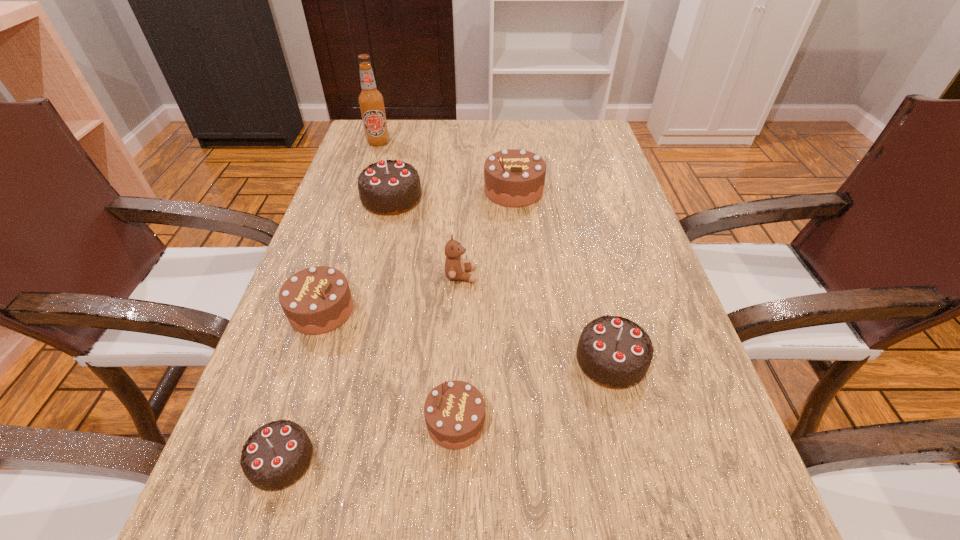
Locate an element on the screen. Image resolution: width=960 pixels, height=540 pixels. free location located 0.130m on the back of the nearest chocolate chocolate cake is located at coordinates (314, 358).

The width and height of the screenshot is (960, 540). I want to click on object that is positioned at the far edge, so click(x=371, y=101).

Locate an element on the screen. The image size is (960, 540). beer bottle located at the left edge is located at coordinates (371, 101).

In order to click on object located in the right edge section of the desktop in this screenshot , I will do `click(614, 352)`.

Identify the location of object that is positioned at the far left corner. (371, 101).

Identify the location of vacant space at the far edge of the desktop. (470, 133).

At what (x,y) coordinates should I click in order to perform the action: click on vacant space at the left edge of the desktop. Please return your answer as a coordinate pair (x, y). Looking at the image, I should click on (369, 288).

In order to click on free spot at the right edge of the desktop in this screenshot , I will do `click(703, 398)`.

The width and height of the screenshot is (960, 540). In the image, there is a desktop. Identify the location of blank space at the far left corner. (402, 147).

What are the coordinates of `vacant space at the far right corner` in the screenshot? It's located at (595, 152).